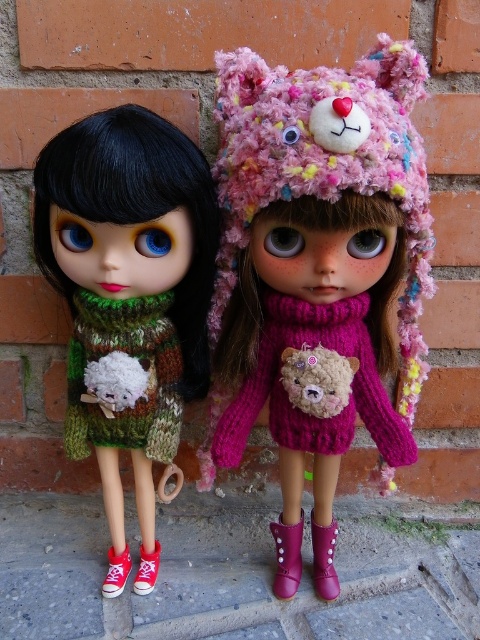
Between point (195, 180) and point (290, 380), which one is positioned in front?

Point (195, 180) is more forward.

The height and width of the screenshot is (640, 480). What do you see at coordinates (129, 298) in the screenshot? I see `green knitted sweater at left` at bounding box center [129, 298].

Find the location of a particular element. This screenshot has height=640, width=480. green knitted sweater at left is located at coordinates (129, 298).

Between green knitted sweater at left and pink knitted sweater at center, which one appears on the left side from the viewer's perspective?

From the viewer's perspective, green knitted sweater at left appears more on the left side.

Can you confirm if green knitted sweater at left is positioned to the right of pink knitted sweater at center?

Incorrect, green knitted sweater at left is not on the right side of pink knitted sweater at center.

Is point (171, 449) closer to viewer compared to point (354, 355)?

No.

Locate an element on the screen. green knitted sweater at left is located at coordinates (129, 298).

Based on the photo, is the position of pink knitted sweater at center more distant than that of fluffy brown bear at center?

No, it is not.

Does pink knitted sweater at center appear under fluffy brown bear at center?

Indeed, pink knitted sweater at center is positioned under fluffy brown bear at center.

Does point (356, 317) come behind point (359, 360)?

No, (356, 317) is closer to viewer.

At what (x,y) coordinates should I click in order to perform the action: click on pink knitted sweater at center. Please return your answer as a coordinate pair (x, y). The width and height of the screenshot is (480, 640). Looking at the image, I should click on (313, 385).